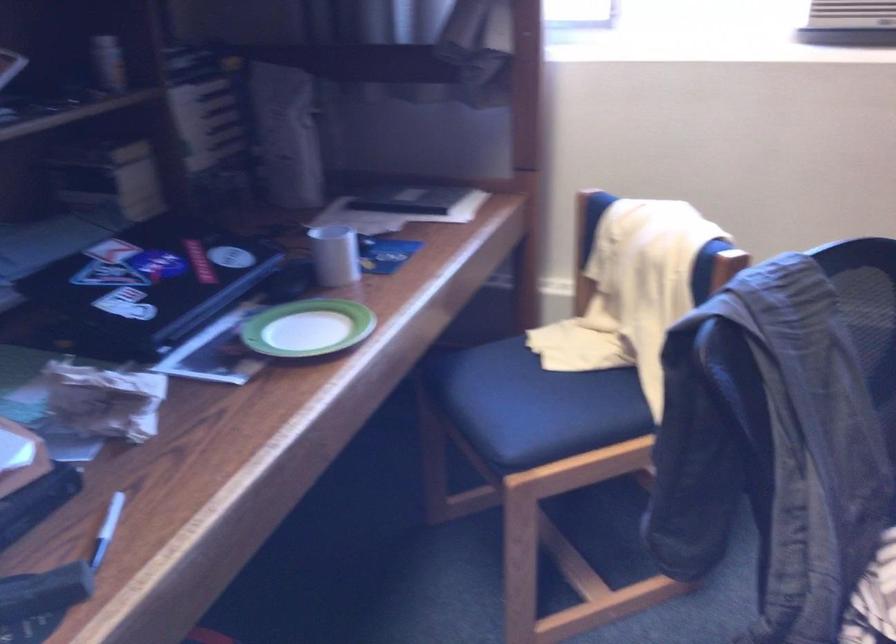
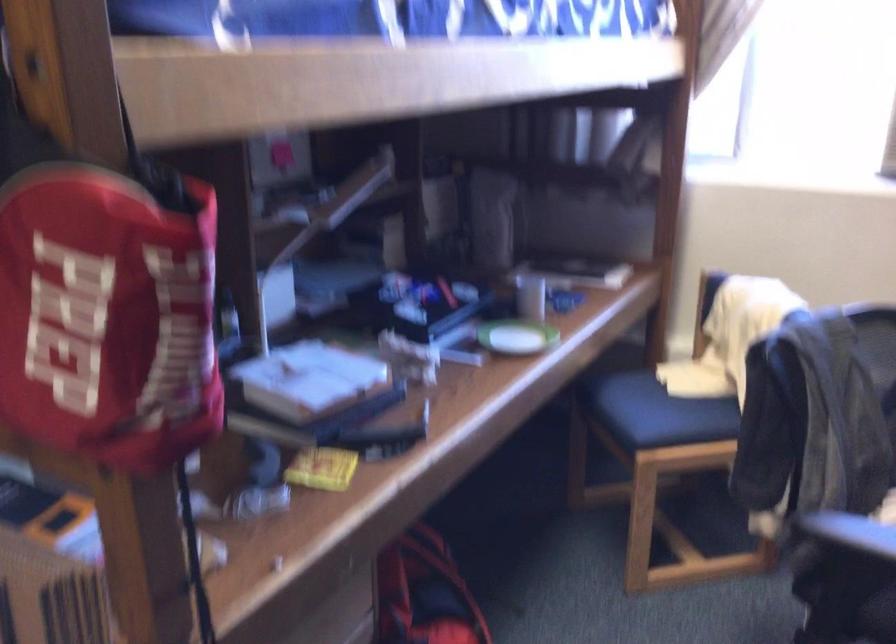
Where in the second image is the point corresponding to (x=343, y=254) from the first image?

(530, 297)